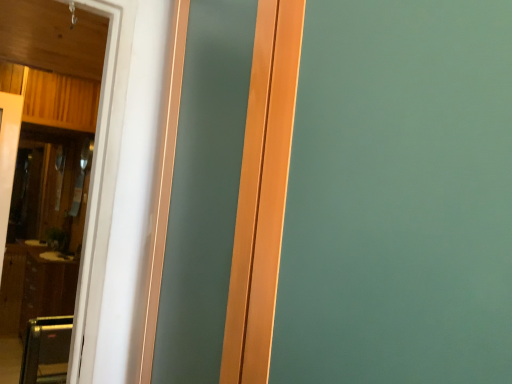
What is the approximate width of matte brown cabinet at left?

18.16 inches.

What do you see at coordinates (34, 288) in the screenshot? I see `matte brown cabinet at left` at bounding box center [34, 288].

You are a GUI agent. You are given a task and a screenshot of the screen. Output one action in this format:
    pyautogui.click(x=<x>, y=<y>)
    Task: Click on the matte brown cabinet at left
    
    Given the screenshot: What is the action you would take?
    pyautogui.click(x=34, y=288)

Image resolution: width=512 pixels, height=384 pixels. In order to click on matte brown cabinet at left in this screenshot , I will do `click(34, 288)`.